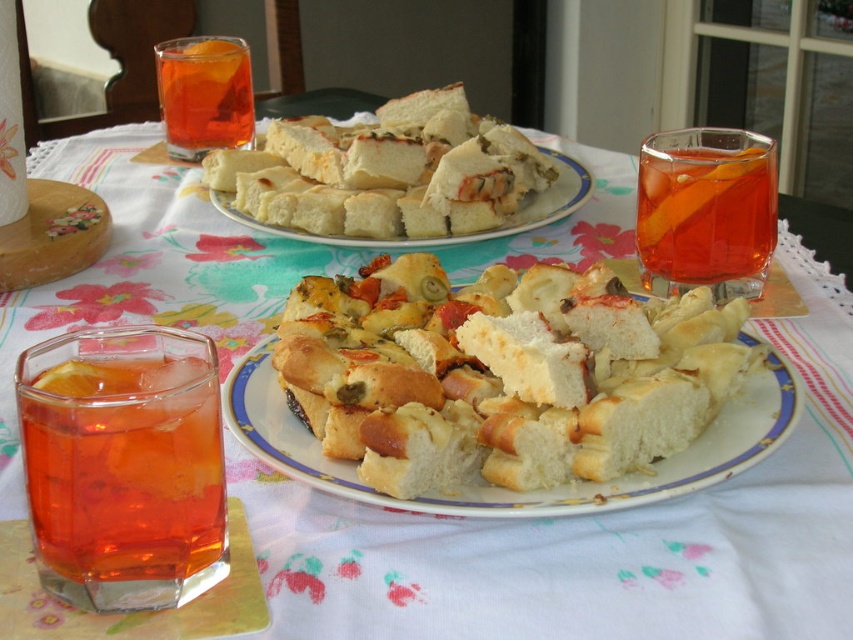
Between golden crusty bread at center and translucent glass drink at upper center, which one has more height?

translucent glass drink at upper center is taller.

Does golden crusty bread at center have a greater height compared to translucent glass drink at upper center?

Incorrect, golden crusty bread at center's height is not larger of translucent glass drink at upper center's.

Find the location of `golden crusty bread at center`. golden crusty bread at center is located at coordinates (503, 380).

Does translucent glass drink at lower left appear on the right side of translucent glass drink at upper center?

Yes, translucent glass drink at lower left is to the right of translucent glass drink at upper center.

Is translucent glass drink at lower left bigger than translucent glass drink at upper center?

Incorrect, translucent glass drink at lower left is not larger than translucent glass drink at upper center.

Who is more distant from viewer, (102, 529) or (195, 42)?

The point (195, 42) is more distant.

I want to click on translucent glass drink at lower left, so click(125, 468).

What do you see at coordinates (125, 468) in the screenshot? This screenshot has width=853, height=640. I see `translucent glass drink at lower left` at bounding box center [125, 468].

Looking at this image, does translucent glass drink at lower left lie behind white bread at center?

No, it is not.

Does point (131, 516) come in front of point (567, 202)?

Yes, point (131, 516) is closer to viewer.

The image size is (853, 640). I want to click on translucent glass drink at lower left, so click(x=125, y=468).